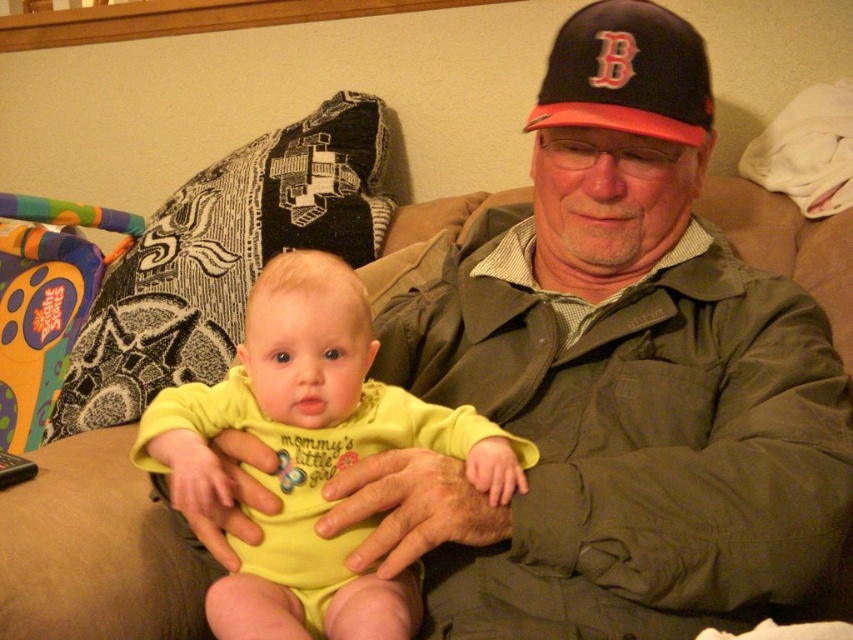
Does point (279, 544) lie in front of point (619, 44)?

Yes.

Consider the image. Is yellow soft fabric baby at center in front of black fabric baseball cap at upper center?

Yes, it is.

What do you see at coordinates (314, 452) in the screenshot? The width and height of the screenshot is (853, 640). I see `yellow soft fabric baby at center` at bounding box center [314, 452].

At what (x,y) coordinates should I click in order to perform the action: click on yellow soft fabric baby at center. Please return your answer as a coordinate pair (x, y). Image resolution: width=853 pixels, height=640 pixels. Looking at the image, I should click on (314, 452).